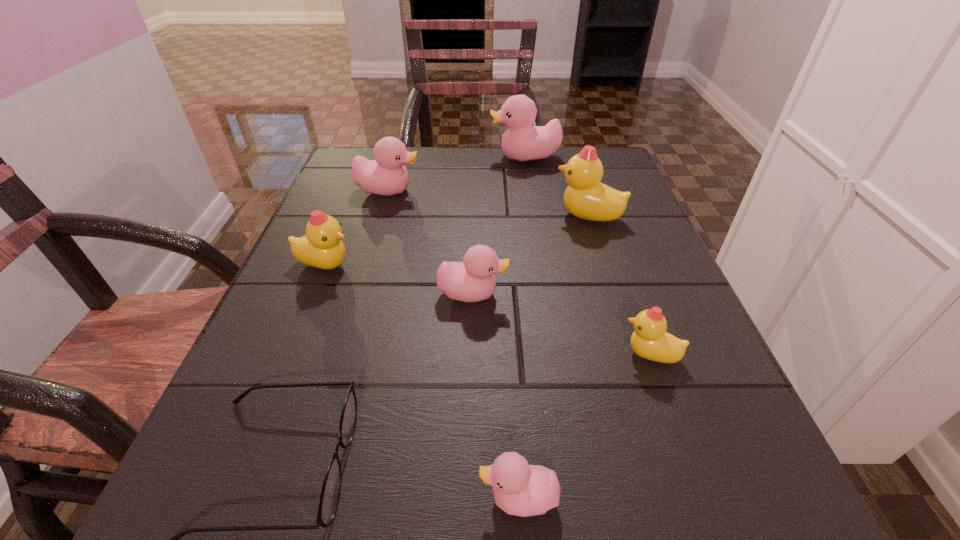
Find the location of a particular element. This screenshot has height=540, width=960. the farthest pink duckling is located at coordinates (521, 142).

Locate an element on the screen. This screenshot has height=540, width=960. the biggest pink duckling is located at coordinates (521, 142).

You are a GUI agent. You are given a task and a screenshot of the screen. Output one action in this format:
    pyautogui.click(x=<x>, y=<y>)
    Task: Click on the fifth nearest duckling
    The height and width of the screenshot is (540, 960).
    Given the screenshot: What is the action you would take?
    [x=587, y=198]

Image resolution: width=960 pixels, height=540 pixels. What are the coordinates of `the third farthest object` in the screenshot? It's located at (587, 198).

Identify the location of the second farthest object. The width and height of the screenshot is (960, 540). (386, 175).

At what (x,y) coordinates should I click in order to perform the action: click on the second biggest pink duckling. Please return your answer as a coordinate pair (x, y). Looking at the image, I should click on (386, 175).

You are a GUI agent. You are given a task and a screenshot of the screen. Output one action in this format:
    pyautogui.click(x=<x>, y=<y>)
    Task: Click on the fourth nearest duckling
    
    Given the screenshot: What is the action you would take?
    click(x=321, y=247)

Image resolution: width=960 pixels, height=540 pixels. In order to click on the second smallest yellow duckling in this screenshot , I will do `click(321, 247)`.

You are a GUI agent. You are given a task and a screenshot of the screen. Output one action in this format:
    pyautogui.click(x=<x>, y=<y>)
    Task: Click on the fourth nearest object
    
    Given the screenshot: What is the action you would take?
    pyautogui.click(x=473, y=280)

This screenshot has height=540, width=960. Find the location of `the second nearest pink duckling`. the second nearest pink duckling is located at coordinates click(473, 280).